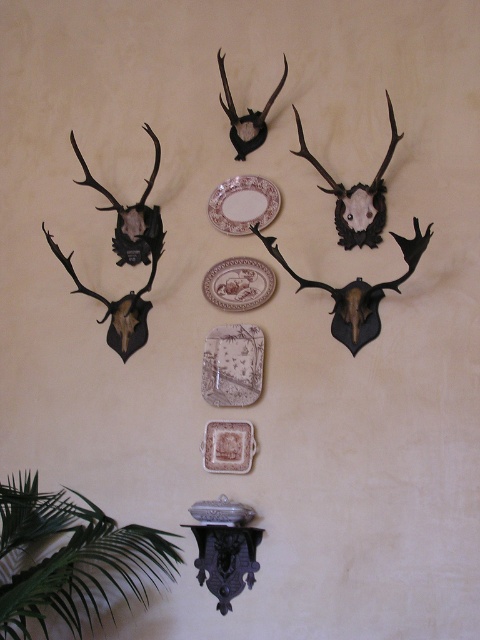
Between porcelain plate at center and white glossy plate at upper center, which one has less height?

Standing shorter between the two is white glossy plate at upper center.

Who is more forward, (227,333) or (228,220)?

Point (227,333)

Image resolution: width=480 pixels, height=640 pixels. I want to click on porcelain plate at center, so click(232, 365).

Where is `porcelain plate at center`? porcelain plate at center is located at coordinates click(x=232, y=365).

Between porcelain plate at center and brown ceramic plate at center, which one has more height?

Standing taller between the two is porcelain plate at center.

Which of these two, porcelain plate at center or brown ceramic plate at center, stands shorter?

brown ceramic plate at center

Where is `porcelain plate at center`? The image size is (480, 640). porcelain plate at center is located at coordinates (232, 365).

Between brown ceramic plate at center and black matte antler at upper center, which one is positioned lower?

Positioned lower is brown ceramic plate at center.

Does brown ceramic plate at center appear on the right side of black matte antler at upper center?

No, brown ceramic plate at center is not to the right of black matte antler at upper center.

Who is more forward, (x=240, y=440) or (x=252, y=113)?

Point (x=240, y=440)

Locate an element on the screen. brown ceramic plate at center is located at coordinates (228, 445).